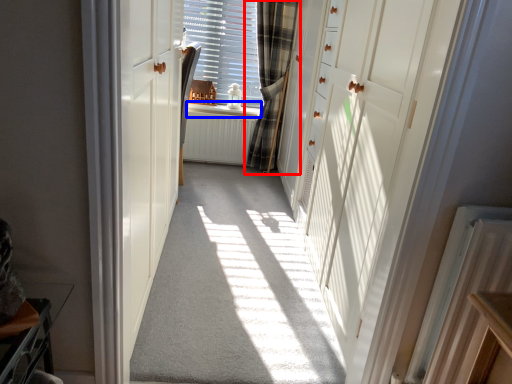
Question: Which object is closer to the camera taking this photo, curtain (highlighted by a red box) or window sill (highlighted by a blue box)?

Choices:
 (A) curtain
 (B) window sill

Answer: (A)